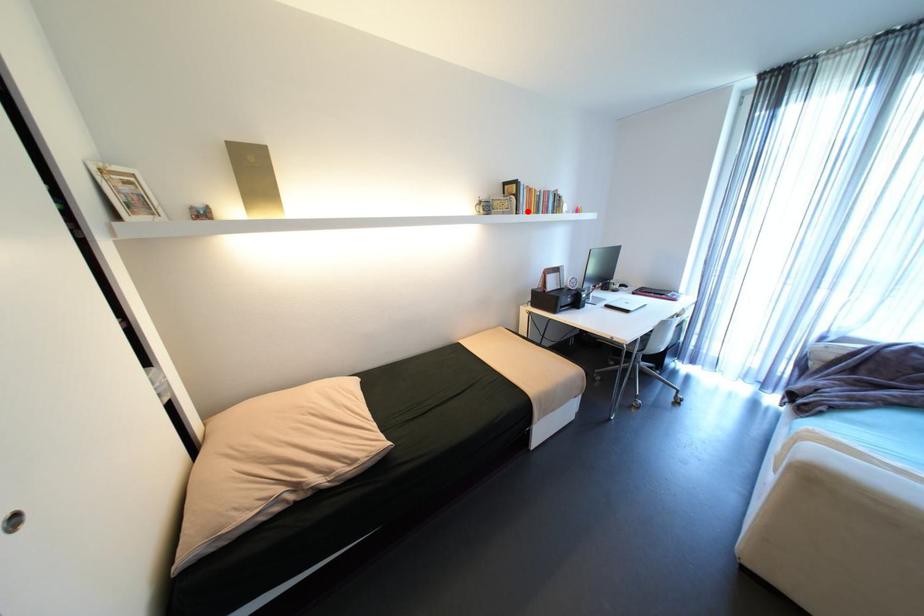
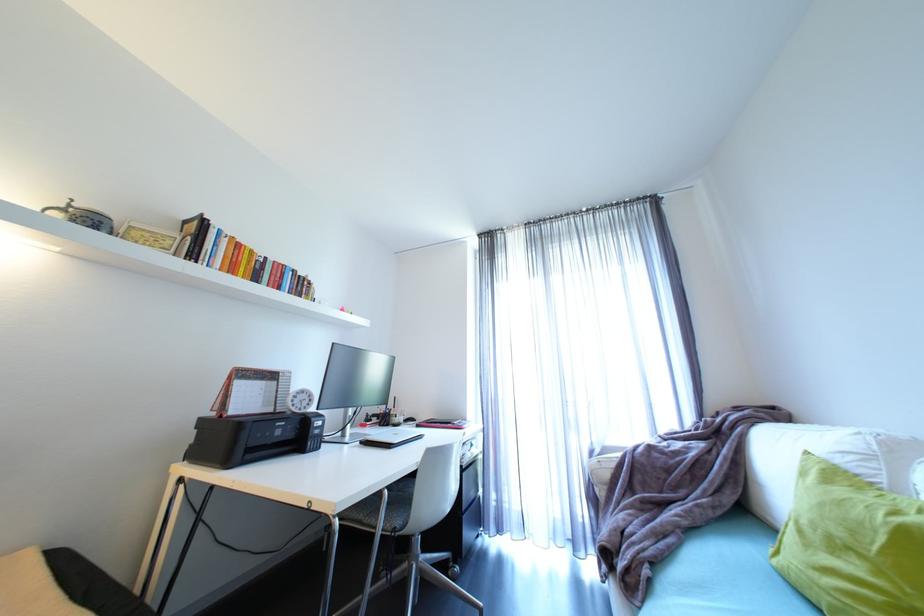
Question: I am providing you with two images of the same scene from different viewpoints. A red point is marked on the first image. Can you still see the location of the red point in image 2?

Choices:
 (A) Yes
 (B) No

Answer: (A)